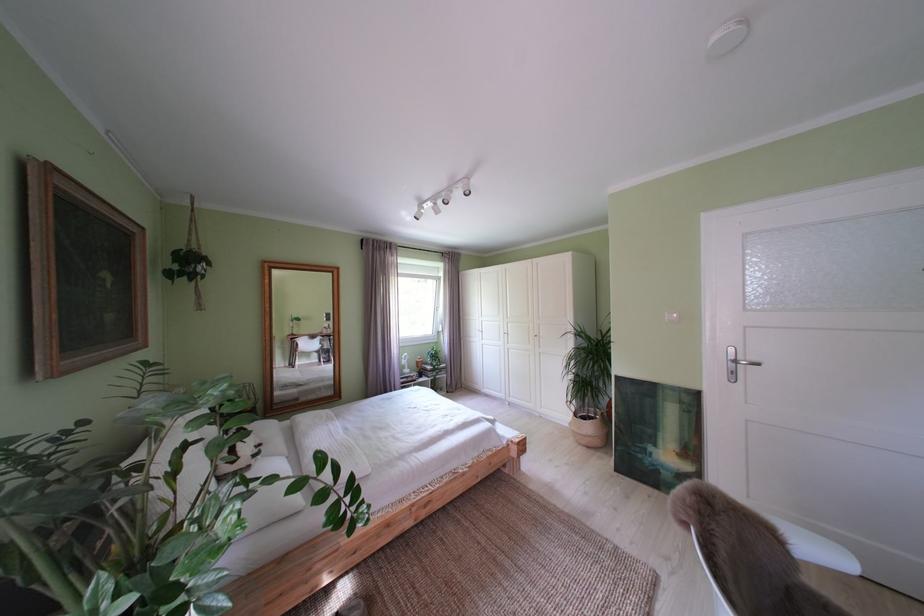
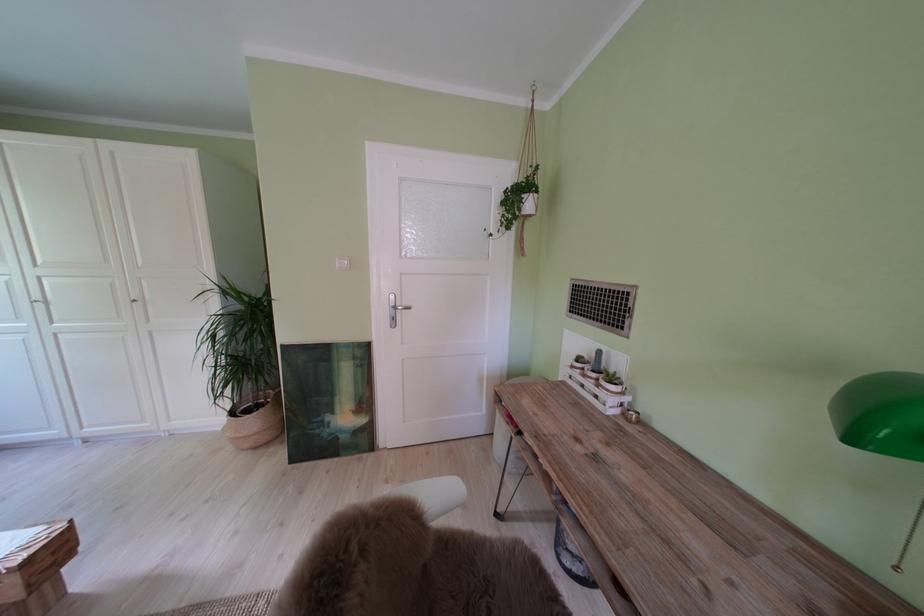
Question: The camera is either moving clockwise (left) or counter-clockwise (right) around the object. The first image is from the beginning of the video and the second image is from the end. Is the camera moving left or right when shooting the video?

Choices:
 (A) Left
 (B) Right

Answer: (A)